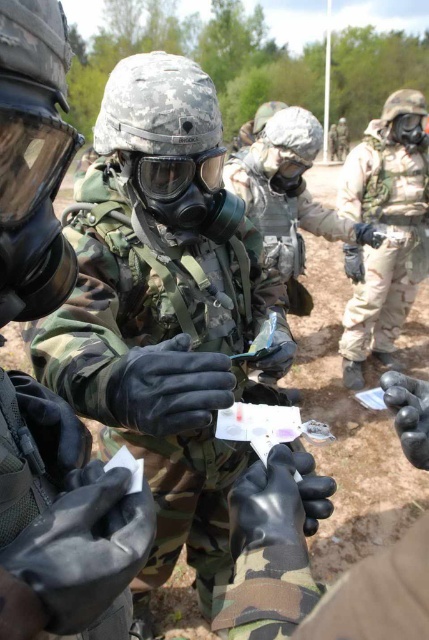
Question: Which of the following is the farthest from the observer?

Choices:
 (A) camouflage fabric gas mask at center
 (B) matte black gas mask at center

Answer: (A)

Question: Which object appears farthest from the camera in this image?

Choices:
 (A) camouflage uniform at center
 (B) camouflage fabric gas mask at center

Answer: (A)

Question: Which object appears farthest from the camera in this image?

Choices:
 (A) matte black gas mask at center
 (B) camouflage fabric gas mask at center
 (C) camouflage uniform at center

Answer: (C)

Question: Is the position of camouflage fabric gas mask at center less distant than that of camouflage uniform at center?

Choices:
 (A) no
 (B) yes

Answer: (B)

Question: Can you confirm if camouflage fabric gas mask at center is wider than matte black gas mask at center?

Choices:
 (A) no
 (B) yes

Answer: (B)

Question: Can you confirm if camouflage fabric gas mask at center is positioned above matte black gas mask at center?

Choices:
 (A) yes
 (B) no

Answer: (B)